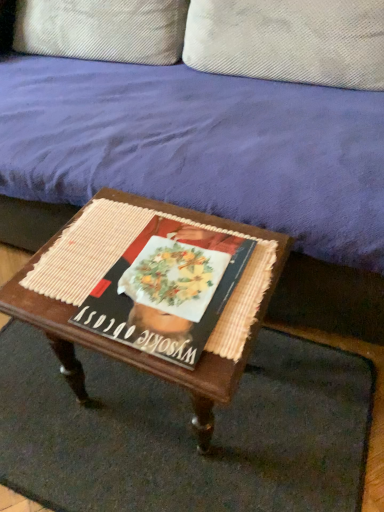
Question: Is point tap(104, 14) closer or farther from the camera than point tap(62, 424)?

Choices:
 (A) closer
 (B) farther

Answer: (B)

Question: From a real-world perspective, is textured beige pillow at upper center, which appears as the first pillow when viewed from the left, above or below woven mat at center?

Choices:
 (A) above
 (B) below

Answer: (A)

Question: Estimate the real-world distances between objects in this image. Which object is closer to the woven wood table at center?

Choices:
 (A) woven mat at center
 (B) textured beige pillow at upper center, which appears as the first pillow when viewed from the left
 (C) velvet purple couch at upper center
 (D) textured beige pillow at upper center, which ranks as the first pillow in right-to-left order
 (E) matte paper magazine at center

Answer: (E)

Question: Which object is the closest to the velvet purple couch at upper center?

Choices:
 (A) woven mat at center
 (B) textured beige pillow at upper center, which appears as the first pillow when viewed from the left
 (C) matte paper magazine at center
 (D) woven wood table at center
 (E) textured beige pillow at upper center, the 2th pillow positioned from the left

Answer: (E)